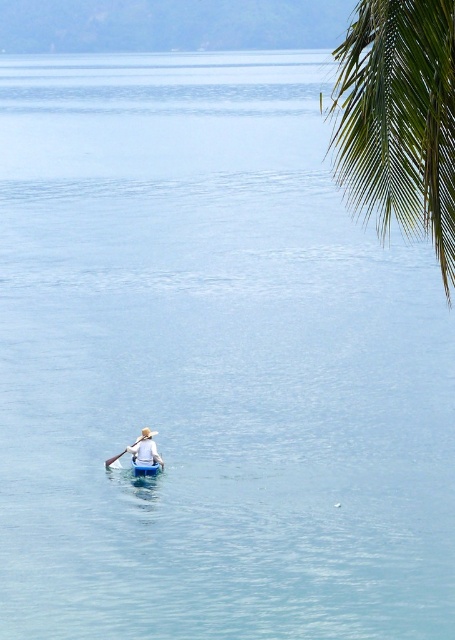
Between green leafy palm tree at upper right and light blue fabric shirt at center, which one appears on the left side from the viewer's perspective?

Answer: light blue fabric shirt at center is more to the left.

Does green leafy palm tree at upper right appear on the left side of light blue fabric shirt at center?

In fact, green leafy palm tree at upper right is to the right of light blue fabric shirt at center.

Who is more distant from viewer, (409, 12) or (145, 433)?

Positioned behind is point (145, 433).

Locate an element on the screen. This screenshot has width=455, height=640. green leafy palm tree at upper right is located at coordinates (399, 120).

Does green leafy palm tree at upper right appear on the left side of blue plastic canoe at center?

Incorrect, green leafy palm tree at upper right is not on the left side of blue plastic canoe at center.

Between green leafy palm tree at upper right and blue plastic canoe at center, which one is positioned higher?

green leafy palm tree at upper right

Is point (436, 76) closer to camera compared to point (135, 460)?

Yes.

Locate an element on the screen. green leafy palm tree at upper right is located at coordinates (399, 120).

Consider the image. Is light blue fabric shirt at center wider than blue plastic canoe at center?

Yes, light blue fabric shirt at center is wider than blue plastic canoe at center.

Does light blue fabric shirt at center appear over blue plastic canoe at center?

Indeed, light blue fabric shirt at center is positioned over blue plastic canoe at center.

What do you see at coordinates (145, 449) in the screenshot? I see `light blue fabric shirt at center` at bounding box center [145, 449].

At what (x,y) coordinates should I click in order to perform the action: click on light blue fabric shirt at center. Please return your answer as a coordinate pair (x, y). Image resolution: width=455 pixels, height=640 pixels. Looking at the image, I should click on (145, 449).